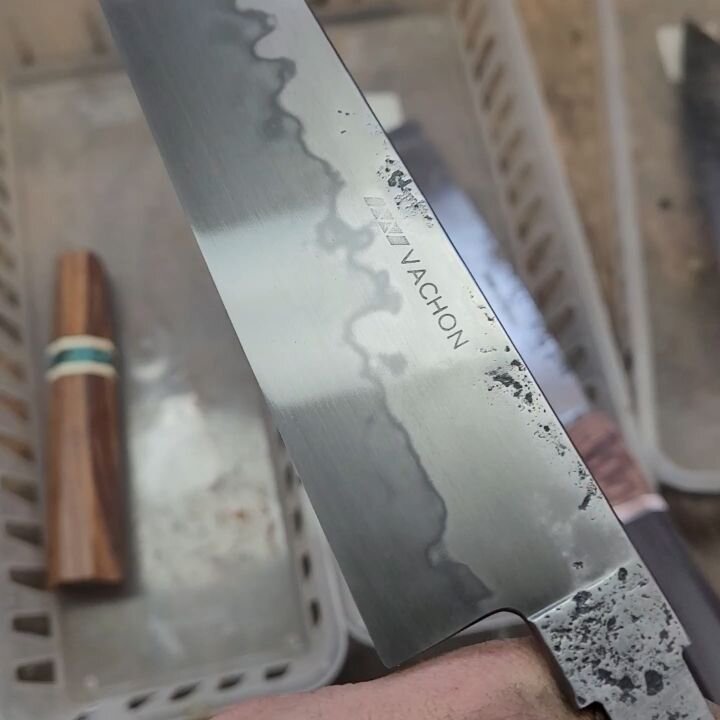
This screenshot has height=720, width=720. Identify the location of floor. (703, 554).